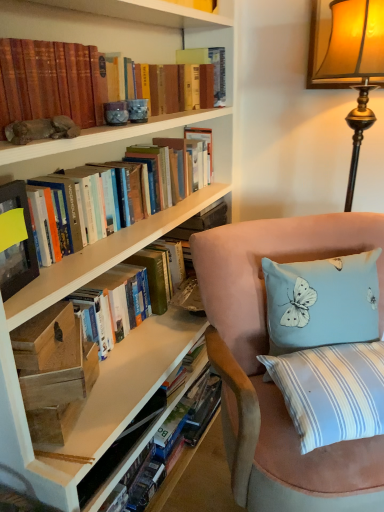
Question: In which direction should I rotate to look at light blue fabric pillow with butterfly design at right?

Choices:
 (A) right
 (B) left

Answer: (A)

Question: Can you confirm if gold textured lampshade at upper right is taller than hardcover book at center, which ranks as the 2th book in top-to-bottom order?

Choices:
 (A) no
 (B) yes

Answer: (B)

Question: Does gold textured lampshade at upper right have a smaller size compared to hardcover book at center, which ranks as the 2th book in top-to-bottom order?

Choices:
 (A) yes
 (B) no

Answer: (B)

Question: Would you consider gold textured lampshade at upper right to be distant from hardcover book at center, which ranks as the 2th book in top-to-bottom order?

Choices:
 (A) no
 (B) yes

Answer: (A)

Question: From the image's perspective, is gold textured lampshade at upper right above hardcover book at center, which ranks as the 2th book in top-to-bottom order?

Choices:
 (A) yes
 (B) no

Answer: (A)

Question: From a real-world perspective, is gold textured lampshade at upper right located higher than hardcover book at center, which ranks as the 2th book in top-to-bottom order?

Choices:
 (A) yes
 (B) no

Answer: (A)

Question: Is gold textured lampshade at upper right in front of hardcover book at center, which ranks as the 2th book in top-to-bottom order?

Choices:
 (A) no
 (B) yes

Answer: (B)

Question: From the image's perspective, would you say matte black book at left, which ranks as the second paperback book in top-to-bottom order, is shown under suede chair at lower right?

Choices:
 (A) no
 (B) yes

Answer: (A)

Question: Is matte black book at left, which is counted as the 4th paperback book, starting from the right, beside suede chair at lower right?

Choices:
 (A) yes
 (B) no

Answer: (B)

Question: Is matte black book at left, which ranks as the second paperback book in top-to-bottom order, bigger than suede chair at lower right?

Choices:
 (A) yes
 (B) no

Answer: (B)

Question: Is the depth of matte black book at left, which is the 4th paperback book in back-to-front order, greater than that of suede chair at lower right?

Choices:
 (A) yes
 (B) no

Answer: (A)

Question: Is matte black book at left, which ranks as the 1th paperback book in front-to-back order, taller than suede chair at lower right?

Choices:
 (A) yes
 (B) no

Answer: (B)

Question: From the image's perspective, is matte black book at left, the first paperback book in the left-to-right sequence, located above suede chair at lower right?

Choices:
 (A) yes
 (B) no

Answer: (A)

Question: Is the depth of hardcover book at center, acting as the 1th book starting from the bottom, greater than that of suede chair at lower right?

Choices:
 (A) no
 (B) yes

Answer: (B)